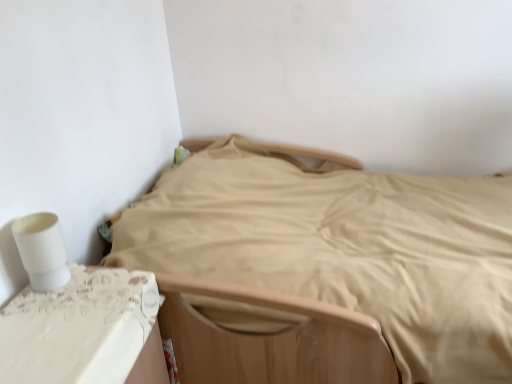
Measure the distance between beige fabric bed at center and camera.

The distance of beige fabric bed at center from camera is 1.16 meters.

This screenshot has width=512, height=384. Find the location of `beige fabric bed at center`. beige fabric bed at center is located at coordinates (344, 247).

Considering the relative sizes of beige fabric bed at center and white lace table at lower left in the image provided, is beige fabric bed at center taller than white lace table at lower left?

Yes.

Between beige fabric bed at center and white lace table at lower left, which one has smaller width?

white lace table at lower left.

In the scene shown: Which object is positioned more to the right, beige fabric bed at center or white lace table at lower left?

beige fabric bed at center.

Is point (142, 231) less distant than point (121, 374)?

No, (142, 231) is behind (121, 374).

Which object is wider, beige fabric bed at center or white matte toilet paper at left?

With larger width is beige fabric bed at center.

From the picture: Is beige fabric bed at center at the right side of white matte toilet paper at left?

Yes.

Is beige fabric bed at center oriented towards white matte toilet paper at left?

No.

Is the depth of beige fabric bed at center greater than that of white matte toilet paper at left?

No, beige fabric bed at center is in front of white matte toilet paper at left.

Between point (84, 273) and point (35, 248), which one is positioned in front?

Point (35, 248)

Is white lace table at lower left oriented towards white matte toilet paper at left?

No, white lace table at lower left is not oriented towards white matte toilet paper at left.

Based on their sizes in the image, would you say white lace table at lower left is bigger or smaller than white matte toilet paper at left?

In the image, white lace table at lower left appears to be larger than white matte toilet paper at left.

Can you tell me how much white lace table at lower left and white matte toilet paper at left differ in facing direction?

The angle between the facing direction of white lace table at lower left and the facing direction of white matte toilet paper at left is 0.484 degrees.

Could you tell me if white matte toilet paper at left is facing white lace table at lower left?

No, white matte toilet paper at left does not turn towards white lace table at lower left.

Which of these two, white matte toilet paper at left or white lace table at lower left, stands taller?

white lace table at lower left.

The height and width of the screenshot is (384, 512). I want to click on toilet paper located on the left of white lace table at lower left, so click(x=42, y=250).

What's the angular difference between white matte toilet paper at left and beige fabric bed at center's facing directions?

178 degrees separate the facing orientations of white matte toilet paper at left and beige fabric bed at center.

Which object is further away from the camera, white matte toilet paper at left or beige fabric bed at center?

white matte toilet paper at left is more distant.

Is white matte toilet paper at left oriented away from beige fabric bed at center?

That's not correct — white matte toilet paper at left is not looking away from beige fabric bed at center.

Considering the relative sizes of white matte toilet paper at left and beige fabric bed at center in the image provided, is white matte toilet paper at left bigger than beige fabric bed at center?

Incorrect, white matte toilet paper at left is not larger than beige fabric bed at center.

Does white lace table at lower left have a greater width compared to beige fabric bed at center?

Incorrect, the width of white lace table at lower left does not surpass that of beige fabric bed at center.

Can you confirm if white lace table at lower left is shorter than beige fabric bed at center?

Yes, white lace table at lower left is shorter than beige fabric bed at center.

From a real-world perspective, is white lace table at lower left on beige fabric bed at center?

Correct, in the physical world, white lace table at lower left is higher than beige fabric bed at center.

Does white lace table at lower left turn towards beige fabric bed at center?

No, white lace table at lower left does not turn towards beige fabric bed at center.

Image resolution: width=512 pixels, height=384 pixels. Find the location of `furniture above the beige fabric bed at center (from a real-world perspective)`. furniture above the beige fabric bed at center (from a real-world perspective) is located at coordinates (78, 328).

Image resolution: width=512 pixels, height=384 pixels. Identify the location of toilet paper behind the beige fabric bed at center. (42, 250).

Which object lies nearer to the anchor point beige fabric bed at center, white lace table at lower left or white matte toilet paper at left?

The object closer to beige fabric bed at center is white lace table at lower left.

When comparing their distances from white matte toilet paper at left, does white lace table at lower left or beige fabric bed at center seem closer?

white lace table at lower left.

When comparing their distances from white lace table at lower left, does white matte toilet paper at left or beige fabric bed at center seem further?

beige fabric bed at center is positioned further to the anchor white lace table at lower left.

Estimate the real-world distances between objects in this image. Which object is closer to white lace table at lower left, beige fabric bed at center or white matte toilet paper at left?

white matte toilet paper at left is positioned closer to the anchor white lace table at lower left.

Which object lies further to the anchor point white matte toilet paper at left, beige fabric bed at center or white lace table at lower left?

beige fabric bed at center is further to white matte toilet paper at left.

From the image, which object appears to be farther from beige fabric bed at center, white matte toilet paper at left or white lace table at lower left?

Among the two, white matte toilet paper at left is located further to beige fabric bed at center.

Where is `furniture situated between white matte toilet paper at left and beige fabric bed at center from left to right`? This screenshot has height=384, width=512. furniture situated between white matte toilet paper at left and beige fabric bed at center from left to right is located at coordinates 78,328.